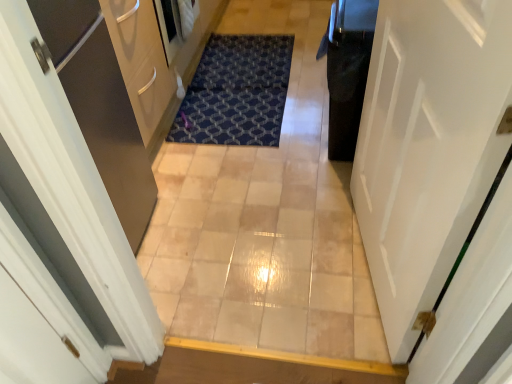
Where is `vacant space in front of blue textured mat at center`? vacant space in front of blue textured mat at center is located at coordinates (241, 193).